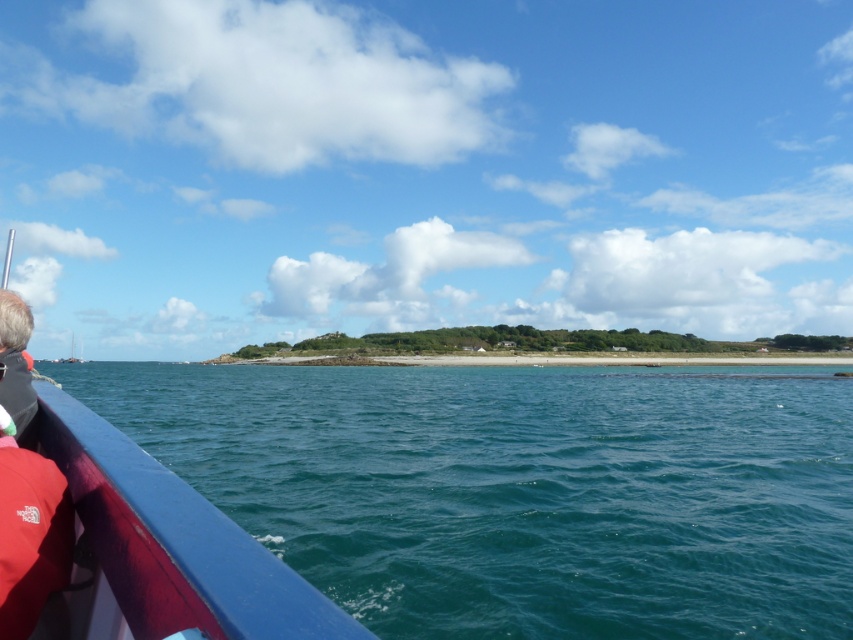
Question: Does smooth blue boat at left lie behind red fabric life jacket at lower left?

Choices:
 (A) no
 (B) yes

Answer: (A)

Question: Which of these objects is positioned farthest from the red fabric life jacket at lower left?

Choices:
 (A) smooth blue boat at left
 (B) gray fabric at left
 (C) deep blue water at lower left

Answer: (C)

Question: Which of the following is the farthest from the observer?

Choices:
 (A) (1, 296)
 (B) (364, 560)

Answer: (B)

Question: Is deep blue water at lower left positioned behind gray fabric at left?

Choices:
 (A) yes
 (B) no

Answer: (A)

Question: Which of the following is the closest to the observer?

Choices:
 (A) (296, 577)
 (B) (601, 369)
 (C) (16, 541)

Answer: (A)

Question: Is deep blue water at lower left closer to camera compared to gray fabric at left?

Choices:
 (A) yes
 (B) no

Answer: (B)